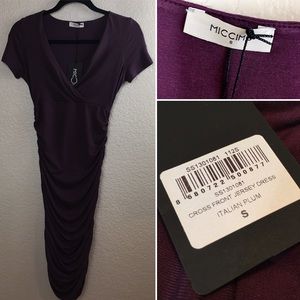
Locate an element on the screen. Image resolution: width=300 pixels, height=300 pixels. sticker is located at coordinates (210, 207).